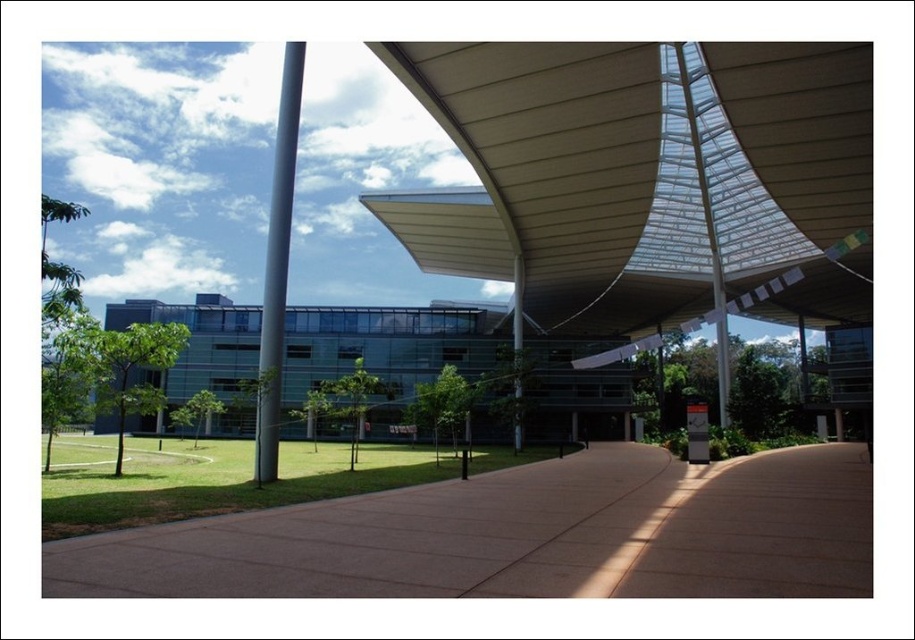
Question: Can you confirm if white textured canopy at upper center is thinner than metallic pole at center?

Choices:
 (A) yes
 (B) no

Answer: (B)

Question: Which object appears farthest from the camera in this image?

Choices:
 (A) white textured canopy at upper center
 (B) brown concrete pavement at center

Answer: (A)

Question: Can you confirm if white textured canopy at upper center is positioned above brown concrete pavement at center?

Choices:
 (A) no
 (B) yes

Answer: (B)

Question: Which point is closer to the camera?

Choices:
 (A) (760, 276)
 (B) (271, 189)
 (C) (437, 554)
 (D) (513, 340)

Answer: (C)

Question: Which point is farther to the camera?

Choices:
 (A) metallic pole at center
 (B) brown concrete pavement at center
 (C) satin silver pole at center
 (D) white textured canopy at upper center

Answer: (A)

Question: Considering the relative positions of brown concrete pavement at center and metallic pole at center in the image provided, where is brown concrete pavement at center located with respect to metallic pole at center?

Choices:
 (A) below
 (B) above

Answer: (A)